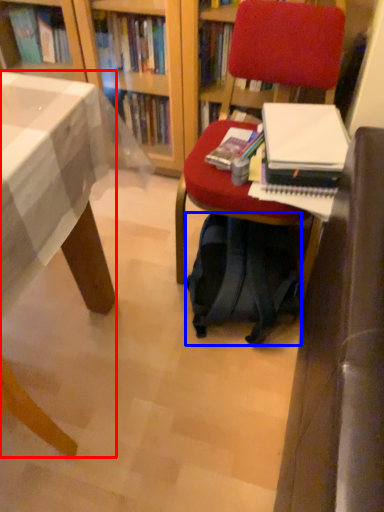
Question: Among these objects, which one is farthest to the camera, desk (highlighted by a red box) or backpack (highlighted by a blue box)?

Choices:
 (A) desk
 (B) backpack

Answer: (B)